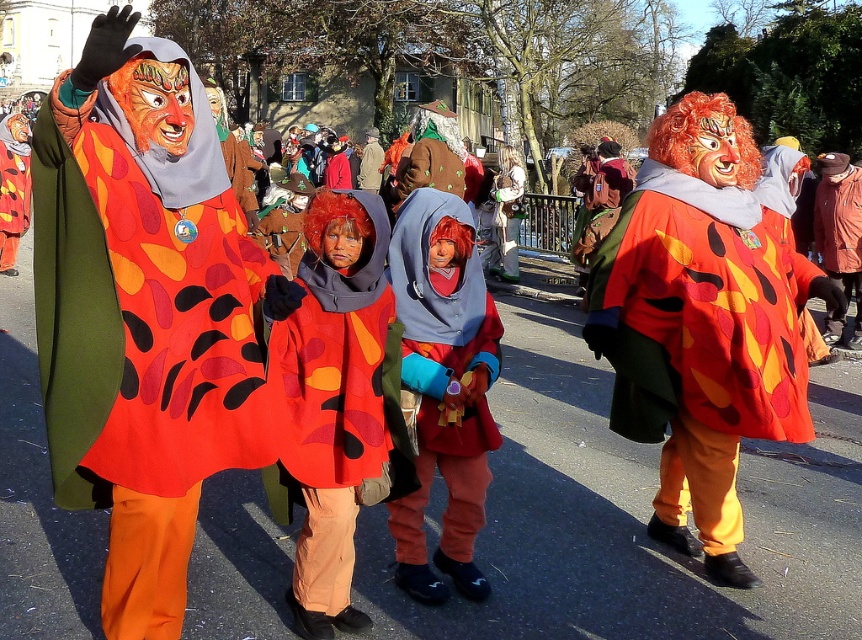
You are a photographer trying to capture a photo of the festive street scene. You notice the matte orange fabric mask at upper left and the matte red cape at center. Which object should you focus on if you want to capture the wider one?

The matte orange fabric mask at upper left might be wider than the matte red cape at center, so focusing on the matte orange fabric mask at upper left would likely capture the wider object.